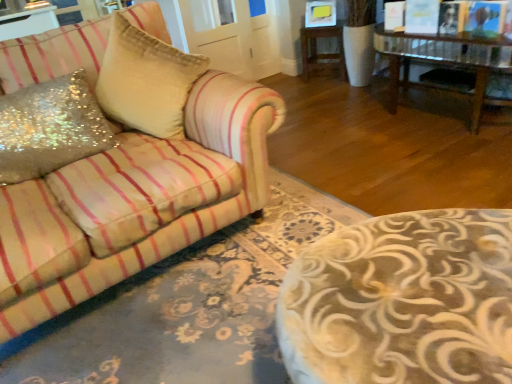
The image size is (512, 384). What do you see at coordinates (50, 128) in the screenshot?
I see `glittery sequined pillow at left, which is the first throw pillow in left-to-right order` at bounding box center [50, 128].

Locate an element on the screen. The width and height of the screenshot is (512, 384). wooden side table at center is located at coordinates (321, 53).

Which of these two, wooden side table at center or glittery sequined pillow at left, which is the second throw pillow from right to left, is wider?

Wider between the two is wooden side table at center.

In terms of size, does wooden side table at center appear bigger or smaller than glittery sequined pillow at left, which is the first throw pillow in left-to-right order?

Considering their sizes, wooden side table at center takes up more space than glittery sequined pillow at left, which is the first throw pillow in left-to-right order.

Is wooden side table at center positioned in front of glittery sequined pillow at left, which is the second throw pillow from right to left?

No, wooden side table at center is further to the viewer.

Based on the photo, considering the relative sizes of wooden side table at center and glittery sequined pillow at left, which is the first throw pillow in left-to-right order, in the image provided, is wooden side table at center shorter than glittery sequined pillow at left, which is the first throw pillow in left-to-right order,?

In fact, wooden side table at center may be taller than glittery sequined pillow at left, which is the first throw pillow in left-to-right order.

Is point (46, 162) behind point (120, 95)?

That is False.

Does glittery sequined pillow at left, which is the second throw pillow from right to left, turn towards sequined fabric pillow at left, arranged as the second throw pillow when viewed from the left?

No, glittery sequined pillow at left, which is the second throw pillow from right to left, is not oriented towards sequined fabric pillow at left, arranged as the second throw pillow when viewed from the left.

From a real-world perspective, is glittery sequined pillow at left, which is the first throw pillow in left-to-right order, positioned over sequined fabric pillow at left, arranged as the second throw pillow when viewed from the left, based on gravity?

No.

Is sequined fabric pillow at left, the 1th throw pillow viewed from the right, looking in the opposite direction of glittery sequined pillow at left, which is the first throw pillow in left-to-right order?

No.

Is sequined fabric pillow at left, the 1th throw pillow viewed from the right, positioned far away from glittery sequined pillow at left, which is the second throw pillow from right to left?

That's not correct — sequined fabric pillow at left, the 1th throw pillow viewed from the right, is a little close to glittery sequined pillow at left, which is the second throw pillow from right to left.

How many degrees apart are the facing directions of sequined fabric pillow at left, the 1th throw pillow viewed from the right, and glittery sequined pillow at left, which is the first throw pillow in left-to-right order?

The facing directions of sequined fabric pillow at left, the 1th throw pillow viewed from the right, and glittery sequined pillow at left, which is the first throw pillow in left-to-right order, are 23.3 degrees apart.

Does point (161, 75) appear closer or farther from the camera than point (70, 127)?

Point (161, 75) appears to be farther away from the viewer than point (70, 127).

Which of these two, sequined fabric pillow at left, the 1th throw pillow viewed from the right, or wooden side table at center, is bigger?

Bigger between the two is sequined fabric pillow at left, the 1th throw pillow viewed from the right.

Is sequined fabric pillow at left, arranged as the second throw pillow when viewed from the left, facing towards wooden side table at center?

No, sequined fabric pillow at left, arranged as the second throw pillow when viewed from the left, does not turn towards wooden side table at center.

From a real-world perspective, which object stands above the other?

sequined fabric pillow at left, the 1th throw pillow viewed from the right.

Are sequined fabric pillow at left, the 1th throw pillow viewed from the right, and wooden side table at center beside each other?

No, sequined fabric pillow at left, the 1th throw pillow viewed from the right, is not in contact with wooden side table at center.

Which object is positioned more to the left, wooden side table at center or sequined fabric pillow at left, arranged as the second throw pillow when viewed from the left?

sequined fabric pillow at left, arranged as the second throw pillow when viewed from the left.

From a real-world perspective, which is physically above, wooden side table at center or sequined fabric pillow at left, the 1th throw pillow viewed from the right?

sequined fabric pillow at left, the 1th throw pillow viewed from the right, is physically above.

Considering the sizes of objects wooden side table at center and sequined fabric pillow at left, the 1th throw pillow viewed from the right, in the image provided, who is bigger, wooden side table at center or sequined fabric pillow at left, the 1th throw pillow viewed from the right,?

sequined fabric pillow at left, the 1th throw pillow viewed from the right.

How distant is wooden side table at center from sequined fabric pillow at left, the 1th throw pillow viewed from the right?

wooden side table at center is 1.95 meters from sequined fabric pillow at left, the 1th throw pillow viewed from the right.

Which object is closer to the camera taking this photo, glittery sequined pillow at left, which is the first throw pillow in left-to-right order, or wooden side table at center?

glittery sequined pillow at left, which is the first throw pillow in left-to-right order, is more forward.

In the scene shown: Is glittery sequined pillow at left, which is the first throw pillow in left-to-right order, at the left side of wooden side table at center?

Correct, you'll find glittery sequined pillow at left, which is the first throw pillow in left-to-right order, to the left of wooden side table at center.

Is glittery sequined pillow at left, which is the first throw pillow in left-to-right order, positioned beyond the bounds of wooden side table at center?

glittery sequined pillow at left, which is the first throw pillow in left-to-right order, lies outside wooden side table at center's area.

Who is taller, glittery sequined pillow at left, which is the first throw pillow in left-to-right order, or wooden side table at center?

wooden side table at center is taller.

From the image's perspective, starting from the wooden side table at center, which throw pillow is the 2nd one below? Please provide its 2D coordinates.

[(50, 128)]

Identify the location of throw pillow located in front of the sequined fabric pillow at left, the 1th throw pillow viewed from the right. This screenshot has height=384, width=512. (x=50, y=128).

Looking at the image, which one is located closer to sequined fabric pillow at left, the 1th throw pillow viewed from the right, glittery sequined pillow at left, which is the first throw pillow in left-to-right order, or wooden side table at center?

glittery sequined pillow at left, which is the first throw pillow in left-to-right order, lies closer to sequined fabric pillow at left, the 1th throw pillow viewed from the right, than the other object.

From the image, which object appears to be farther from glittery sequined pillow at left, which is the first throw pillow in left-to-right order, wooden side table at center or sequined fabric pillow at left, arranged as the second throw pillow when viewed from the left?

wooden side table at center.

Based on their spatial positions, is sequined fabric pillow at left, the 1th throw pillow viewed from the right, or glittery sequined pillow at left, which is the first throw pillow in left-to-right order, further from wooden side table at center?

Based on the image, glittery sequined pillow at left, which is the first throw pillow in left-to-right order, appears to be further to wooden side table at center.

From the image, which object appears to be farther from wooden side table at center, glittery sequined pillow at left, which is the second throw pillow from right to left, or sequined fabric pillow at left, arranged as the second throw pillow when viewed from the left?

glittery sequined pillow at left, which is the second throw pillow from right to left.

From the image, which object appears to be nearer to glittery sequined pillow at left, which is the first throw pillow in left-to-right order, sequined fabric pillow at left, arranged as the second throw pillow when viewed from the left, or wooden side table at center?

The object closer to glittery sequined pillow at left, which is the first throw pillow in left-to-right order, is sequined fabric pillow at left, arranged as the second throw pillow when viewed from the left.

Considering their positions, is wooden side table at center positioned closer to sequined fabric pillow at left, arranged as the second throw pillow when viewed from the left, than glittery sequined pillow at left, which is the second throw pillow from right to left?

glittery sequined pillow at left, which is the second throw pillow from right to left, is positioned closer to the anchor sequined fabric pillow at left, arranged as the second throw pillow when viewed from the left.

The image size is (512, 384). In order to click on throw pillow between glittery sequined pillow at left, which is the first throw pillow in left-to-right order, and wooden side table at center in the front-back direction in this screenshot , I will do `click(146, 80)`.